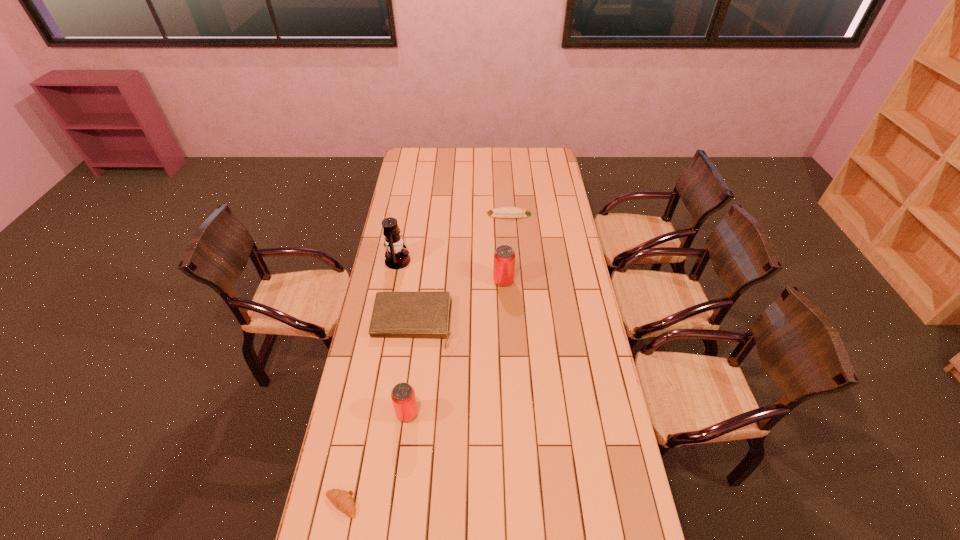
The cans are evenly distributed in the image. To maintain this, where would you place another can on the right? Please point to a free space. Please provide its 2D coordinates. Your answer should be formatted as a tuple, i.e. [(x, y)], where the tuple contains the x and y coordinates of a point satisfying the conditions above.

[(564, 197)]